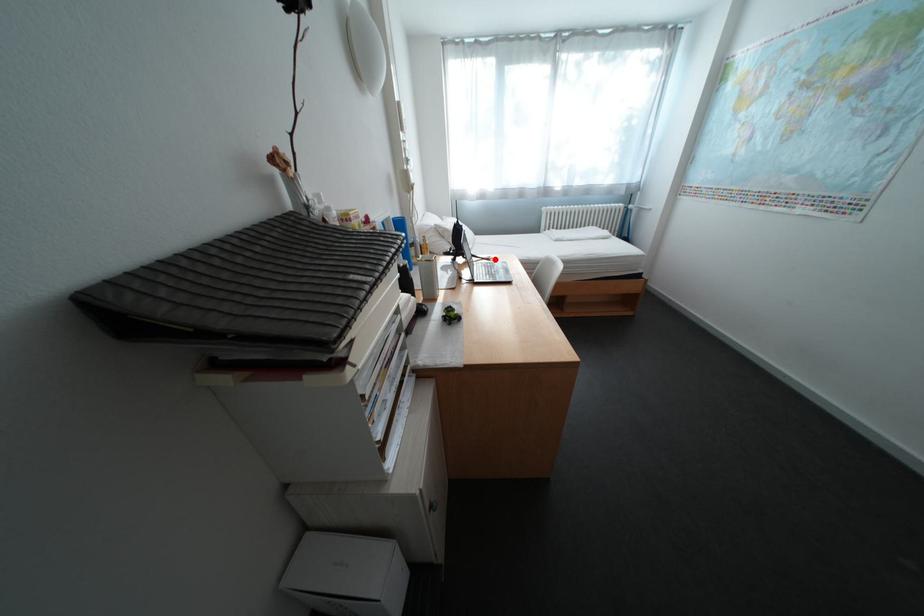
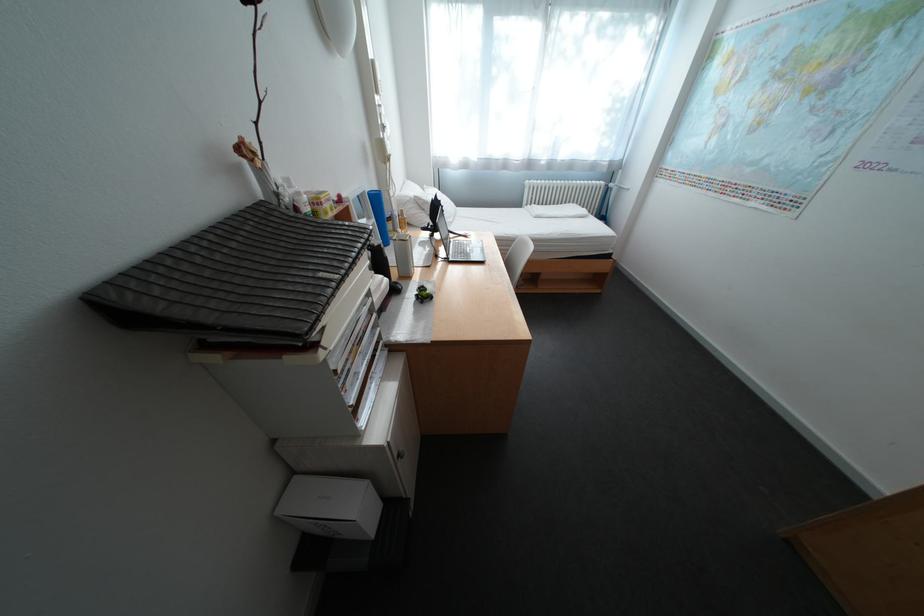
The point at the highlighted location is marked in the first image. Where is the corresponding point in the second image?

(472, 236)